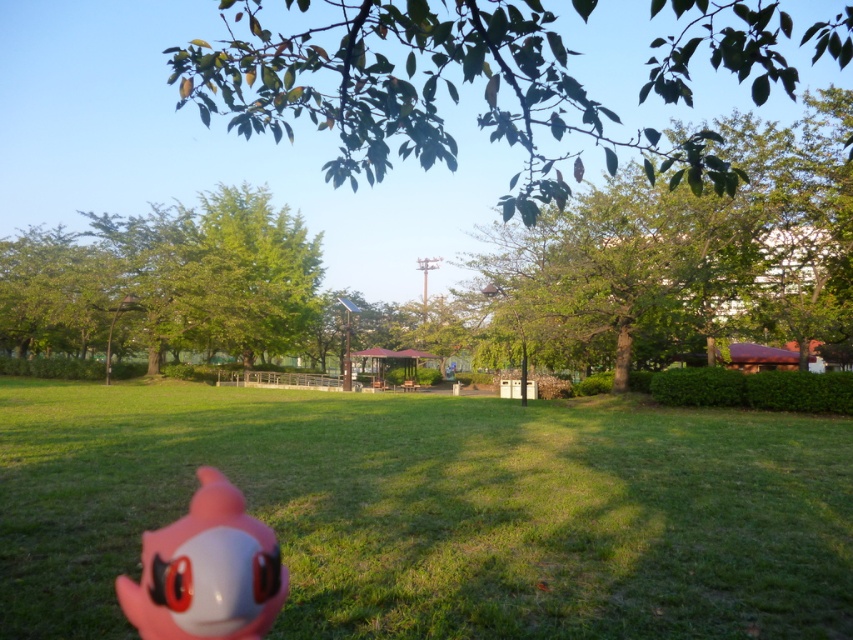
You are standing in the park and want to walk from the green leafy tree at center to the green leafy tree at upper right. Which direction should you head towards?

You should head towards the right direction since the green leafy tree at upper right is located to the right of the green leafy tree at center.

You are a child who wants to throw the pink rubber toy at lower left as far as possible. Which direction should you aim to avoid hitting the green glossy leaves at upper center?

The green glossy leaves at upper center might be wider than the pink rubber toy at lower left, so aiming away from the upper center direction would be best to avoid hitting them.

You are a child playing in the park and see the green glossy leaves at upper center and the pink rubber toy at lower left. Which object is positioned to the right of the other?

The green glossy leaves at upper center are positioned to the right of the pink rubber toy at lower left.